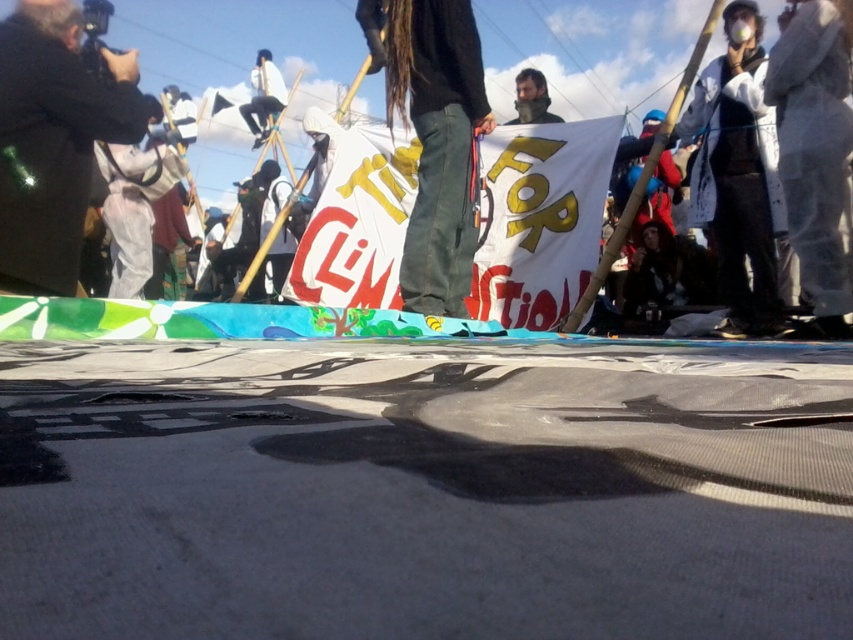
Which is behind, point (39, 93) or point (547, 102)?

The point (547, 102) is more distant.

Is dark gray jacket at left further to the viewer compared to smooth black jacket at upper center?

No, dark gray jacket at left is in front of smooth black jacket at upper center.

Who is more forward, [25,193] or [531,112]?

Point [25,193]

This screenshot has height=640, width=853. Find the location of `dark gray jacket at left`. dark gray jacket at left is located at coordinates (53, 140).

Which is behind, point (36, 84) or point (750, 301)?

The point (750, 301) is more distant.

Who is more forward, (x=39, y=184) or (x=766, y=260)?

Positioned in front is point (x=39, y=184).

Describe the element at coordinates (53, 140) in the screenshot. The width and height of the screenshot is (853, 640). I see `dark gray jacket at left` at that location.

The height and width of the screenshot is (640, 853). I want to click on dark gray jacket at left, so click(53, 140).

Which is below, white fabric mask at upper right or smooth black jacket at upper center?

white fabric mask at upper right is below.

Between point (733, 108) and point (526, 120), which one is positioned behind?

Positioned behind is point (526, 120).

Identify the location of white fabric mask at upper right. The height and width of the screenshot is (640, 853). (737, 173).